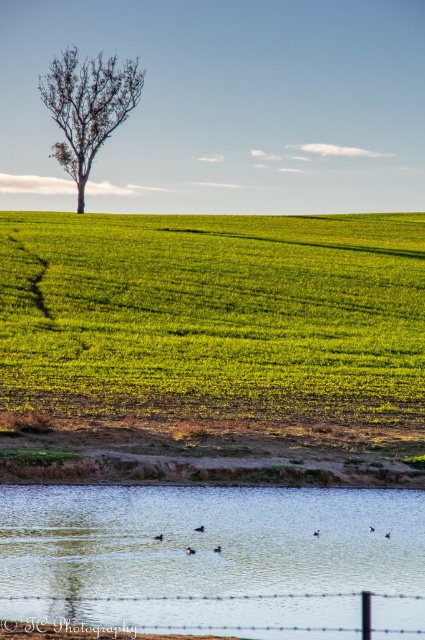
Question: Is green grassy field at center bigger than bare brown tree at upper left?

Choices:
 (A) no
 (B) yes

Answer: (A)

Question: Observing the image, what is the correct spatial positioning of clear water at lower center in reference to bare brown tree at upper left?

Choices:
 (A) right
 (B) left

Answer: (A)

Question: Which object is positioned farthest from the barbed wire fence at lower center?

Choices:
 (A) clear water at lower center
 (B) green grassy field at center

Answer: (B)

Question: Estimate the real-world distances between objects in this image. Which object is farther from the green grassy field at center?

Choices:
 (A) bare brown tree at upper left
 (B) clear water at lower center

Answer: (A)

Question: Which object is farther from the camera taking this photo?

Choices:
 (A) barbed wire fence at lower center
 (B) clear water at lower center

Answer: (A)

Question: Does green grassy field at center lie behind clear water at lower center?

Choices:
 (A) no
 (B) yes

Answer: (B)